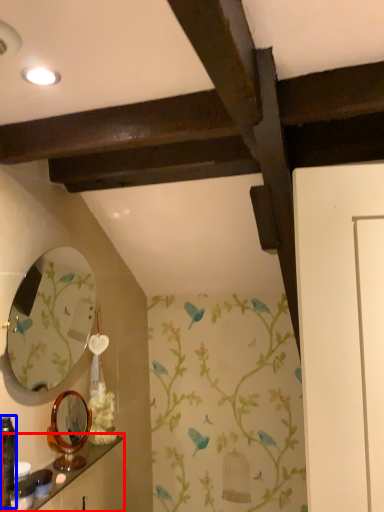
Question: Which object is closer to the camera taking this photo, shelf (highlighted by a red box) or toiletry (highlighted by a blue box)?

Choices:
 (A) shelf
 (B) toiletry

Answer: (B)